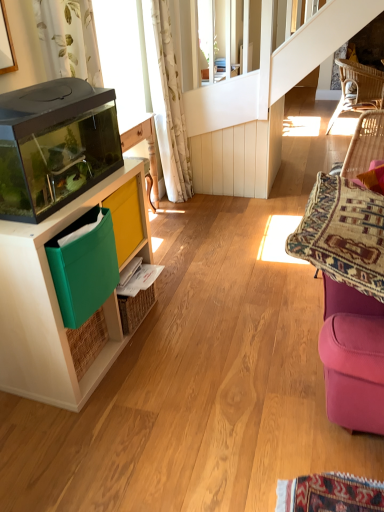
In order to click on vacant space in front of white floral fabric curtain at upper left in this screenshot , I will do `click(190, 206)`.